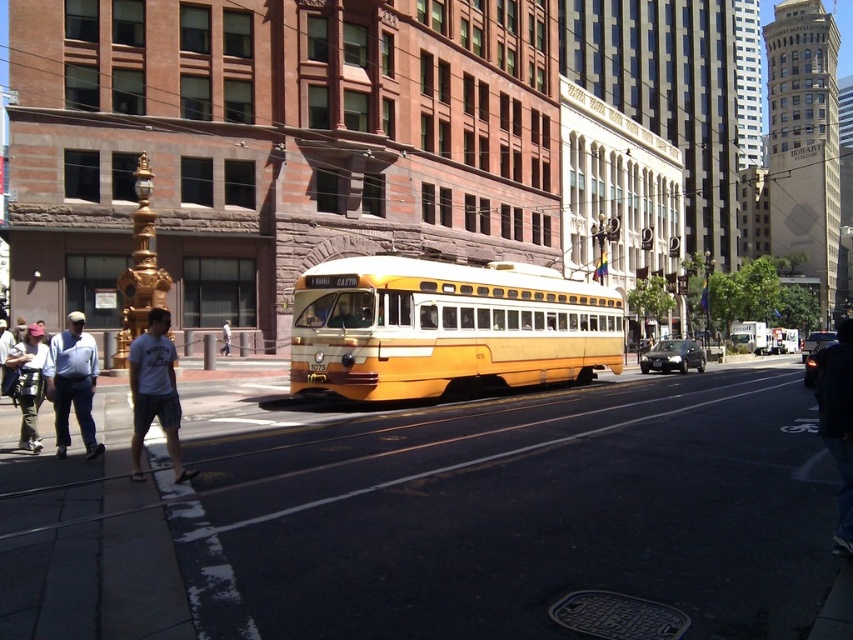
Does white cotton t-shirt at left have a lesser width compared to yellow matte bus at center?

In fact, white cotton t-shirt at left might be wider than yellow matte bus at center.

Does white cotton t-shirt at left have a smaller size compared to yellow matte bus at center?

No, white cotton t-shirt at left is not smaller than yellow matte bus at center.

Is point (140, 384) behind point (761, 353)?

No, it is in front of (761, 353).

The image size is (853, 640). I want to click on white cotton t-shirt at left, so click(154, 392).

Which is above, white cotton t-shirt at left or white cotton shirt at center?

white cotton t-shirt at left is above.

Does white cotton t-shirt at left appear under white cotton shirt at center?

Actually, white cotton t-shirt at left is above white cotton shirt at center.

Which is in front, point (165, 406) or point (225, 336)?

Point (165, 406)

This screenshot has height=640, width=853. I want to click on white cotton t-shirt at left, so click(x=154, y=392).

Is light blue shirt at left closer to the viewer compared to white cotton shirt at lower left?

Yes, it is.

Is light blue shirt at left shorter than white cotton shirt at lower left?

No.

Does point (57, 403) lie behind point (26, 332)?

That is False.

The width and height of the screenshot is (853, 640). I want to click on light blue shirt at left, so click(73, 384).